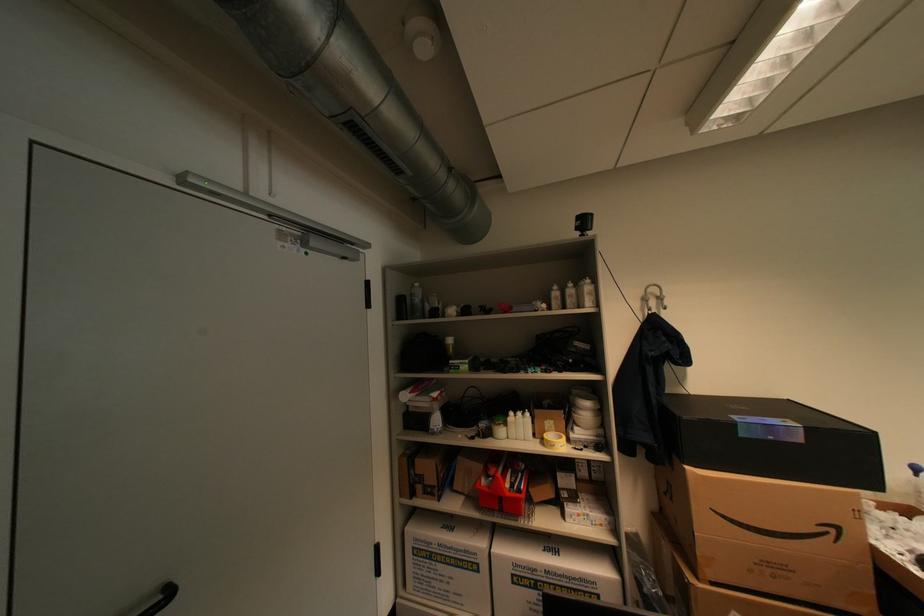
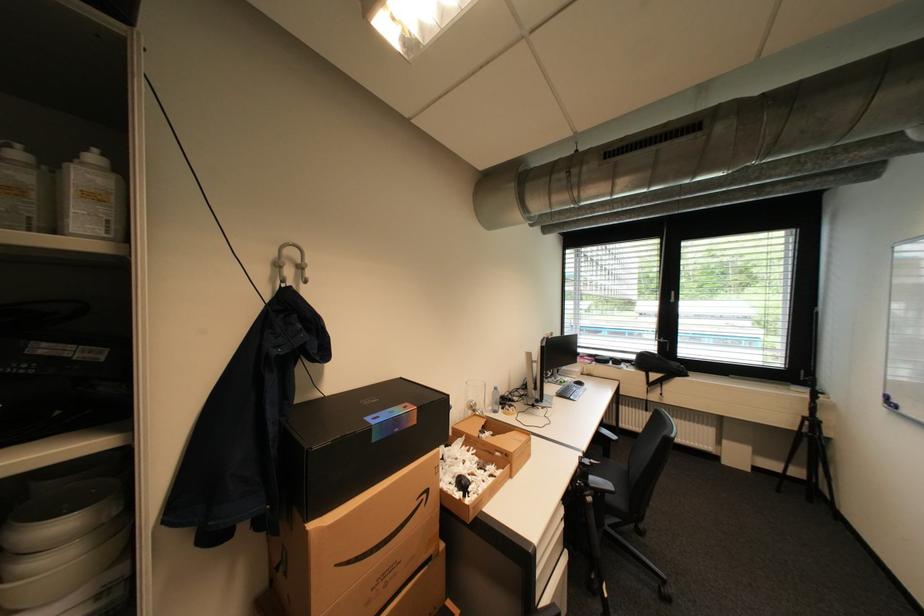
Question: How did the camera likely rotate?

Choices:
 (A) Left
 (B) Right
 (C) Up
 (D) Down

Answer: (B)